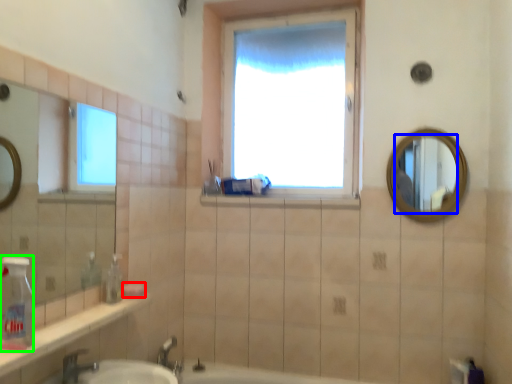
Question: Which object is positioned closest to soap (highlighted by a red box)? Select from mirror (highlighted by a blue box) and bottle (highlighted by a green box).

Choices:
 (A) mirror
 (B) bottle

Answer: (B)